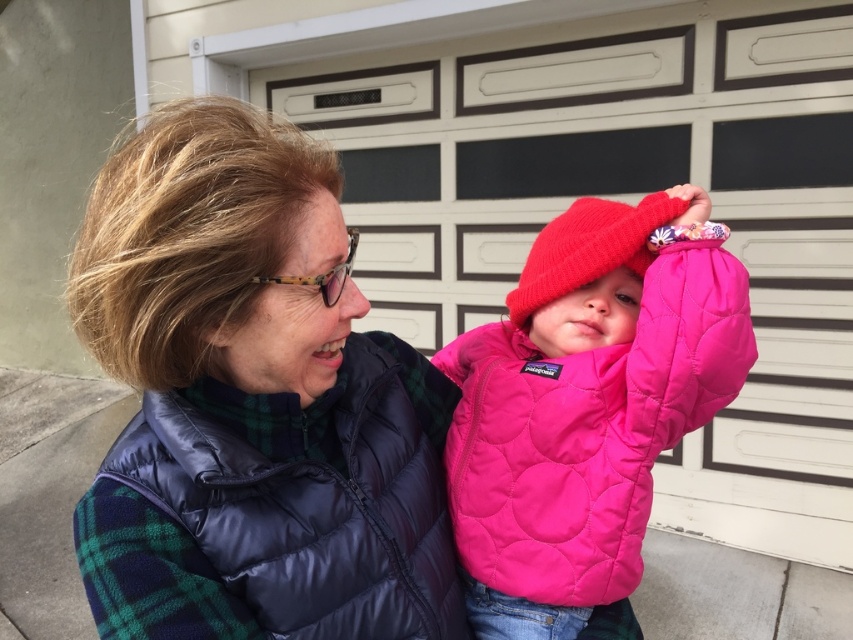
At what (x,y) coordinates should I click in order to perform the action: click on pink quilted jacket at center. Please return your answer as a coordinate pair (x, y). Looking at the image, I should click on (585, 404).

Is pink quilted jacket at center bigger than knitted woolen hat at center?

Correct, pink quilted jacket at center is larger in size than knitted woolen hat at center.

Is point (604, 388) in front of point (602, 214)?

Yes, it is.

Where is `pink quilted jacket at center`? pink quilted jacket at center is located at coordinates (585, 404).

Looking at this image, which is below, navy blue puffer jacket at center or knitted woolen hat at center?

Positioned lower is navy blue puffer jacket at center.

How distant is navy blue puffer jacket at center from knitted woolen hat at center?

navy blue puffer jacket at center is 15.54 inches away from knitted woolen hat at center.

Identify the location of navy blue puffer jacket at center. (267, 506).

Between pink quilted jacket at center and navy blue puffer jacket at center, which one has more height?

Standing taller between the two is pink quilted jacket at center.

Between pink quilted jacket at center and navy blue puffer jacket at center, which one appears on the left side from the viewer's perspective?

navy blue puffer jacket at center is more to the left.

Which is in front, point (666, 284) or point (160, 579)?

Point (160, 579) is more forward.

What are the coordinates of `pink quilted jacket at center` in the screenshot? It's located at (585, 404).